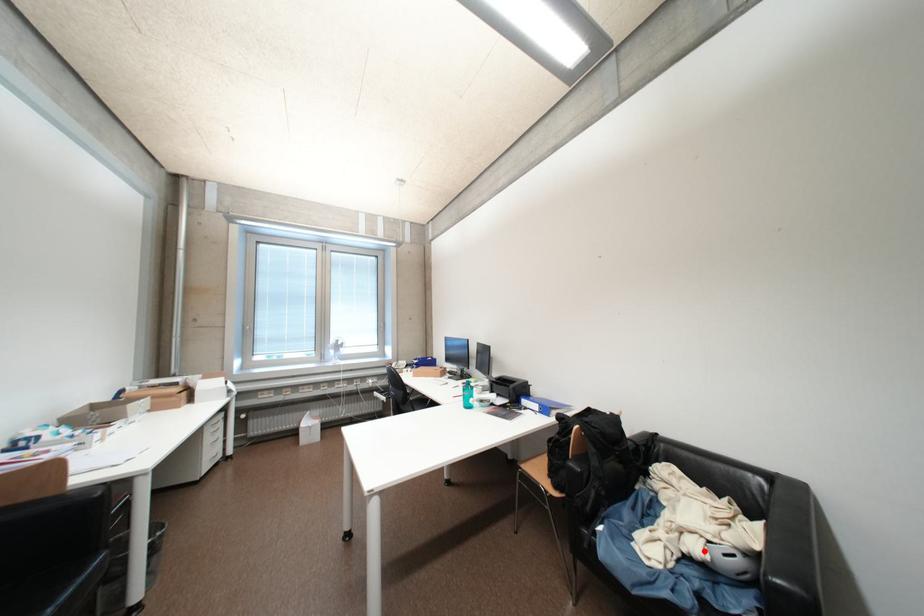
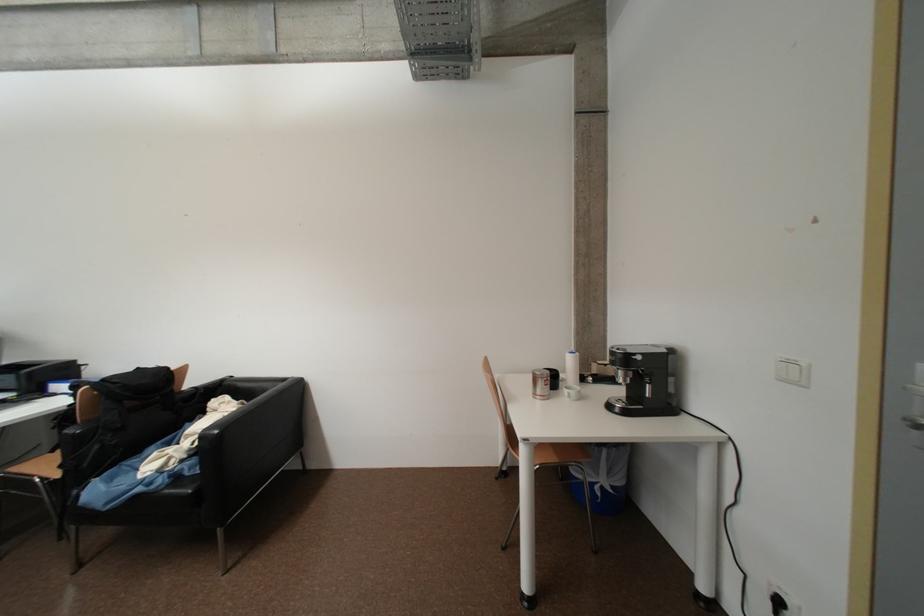
Question: I am providing you with two images of the same scene from different viewpoints. A red point is marked on the first image. At the location where the point appears in image 1, is it still visible in image 2?

Choices:
 (A) Yes
 (B) No

Answer: (B)